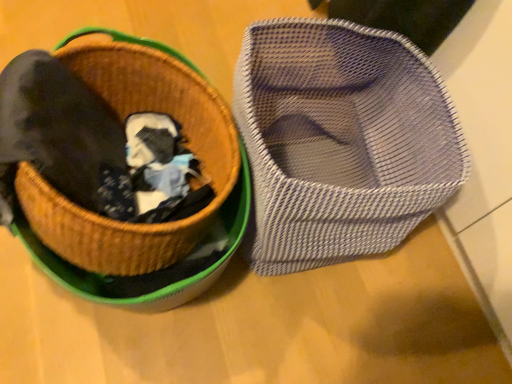
Question: Is mesh fabric shoe at right surrounding woven straw basket at upper left?

Choices:
 (A) yes
 (B) no

Answer: (B)

Question: Can you confirm if mesh fabric shoe at right is wider than woven straw basket at upper left?

Choices:
 (A) no
 (B) yes

Answer: (A)

Question: Considering the relative sizes of mesh fabric shoe at right and woven straw basket at upper left in the image provided, is mesh fabric shoe at right thinner than woven straw basket at upper left?

Choices:
 (A) no
 (B) yes

Answer: (B)

Question: From the image's perspective, is mesh fabric shoe at right below woven straw basket at upper left?

Choices:
 (A) no
 (B) yes

Answer: (B)

Question: From a real-world perspective, is mesh fabric shoe at right beneath woven straw basket at upper left?

Choices:
 (A) yes
 (B) no

Answer: (A)

Question: Is mesh fabric shoe at right not inside woven straw basket at upper left?

Choices:
 (A) no
 (B) yes

Answer: (B)

Question: Would you consider woven straw basket at upper left to be distant from mesh fabric shoe at right?

Choices:
 (A) yes
 (B) no

Answer: (B)

Question: Considering the relative positions of woven straw basket at upper left and mesh fabric shoe at right in the image provided, is woven straw basket at upper left to the left of mesh fabric shoe at right from the viewer's perspective?

Choices:
 (A) no
 (B) yes

Answer: (B)

Question: From the image's perspective, is woven straw basket at upper left located beneath mesh fabric shoe at right?

Choices:
 (A) yes
 (B) no

Answer: (B)

Question: From the image's perspective, does woven straw basket at upper left appear higher than mesh fabric shoe at right?

Choices:
 (A) no
 (B) yes

Answer: (B)

Question: Can you confirm if woven straw basket at upper left is taller than mesh fabric shoe at right?

Choices:
 (A) yes
 (B) no

Answer: (B)

Question: Does woven straw basket at upper left have a greater width compared to mesh fabric shoe at right?

Choices:
 (A) yes
 (B) no

Answer: (A)

Question: From the image's perspective, is mesh fabric shoe at right above or below woven straw basket at upper left?

Choices:
 (A) above
 (B) below

Answer: (B)